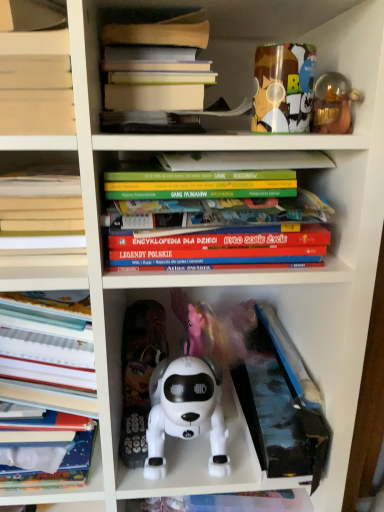
The width and height of the screenshot is (384, 512). Find the location of `blue matte book at lower right`. blue matte book at lower right is located at coordinates pyautogui.click(x=282, y=405).

Describe the element at coordinates (282, 405) in the screenshot. I see `blue matte book at lower right` at that location.

What do you see at coordinates (186, 412) in the screenshot?
I see `white plastic robot dog at center, which ranks as the second toy in left-to-right order` at bounding box center [186, 412].

What do you see at coordinates (48, 381) in the screenshot?
I see `white paper book at left, positioned as the fourth book in top-to-bottom order` at bounding box center [48, 381].

The image size is (384, 512). What do you see at coordinates (283, 88) in the screenshot? I see `matte plastic cup at upper right, the second toy from the right` at bounding box center [283, 88].

Measure the distance between matte plastic cup at upper right, placed as the first toy when sorted from top to bottom, and camera.

matte plastic cup at upper right, placed as the first toy when sorted from top to bottom, is 51.98 centimeters from camera.

Find the location of `hardcover books at upper center, the 4th book when ordered from bottom to top`. hardcover books at upper center, the 4th book when ordered from bottom to top is located at coordinates (156, 64).

What is the approximate width of translucent glass figurine at upper right, which is the fourth toy from left to right?

The width of translucent glass figurine at upper right, which is the fourth toy from left to right, is 2.68 inches.

Identify the location of blue matte book at lower right. This screenshot has width=384, height=512. (282, 405).

Is point (294, 418) positioned before point (299, 75)?

No, (294, 418) is further to viewer.

Are blue matte book at lower right and matte plastic cup at upper right, which appears as the 3th toy when viewed from the left, making contact?

No, blue matte book at lower right is not in contact with matte plastic cup at upper right, which appears as the 3th toy when viewed from the left.

Who is shorter, blue matte book at lower right or matte plastic cup at upper right, which appears as the 3th toy when viewed from the left?

matte plastic cup at upper right, which appears as the 3th toy when viewed from the left, is shorter.

From a real-world perspective, is blue matte book at lower right under matte plastic cup at upper right, which appears as the 3th toy when viewed from the left?

Yes, from a real-world perspective, blue matte book at lower right is under matte plastic cup at upper right, which appears as the 3th toy when viewed from the left.

Who is bigger, hardcover book at left, which is the second book in bottom-to-top order, or blue matte book at lower right?

Bigger between the two is blue matte book at lower right.

Is hardcover book at left, which is the second book in bottom-to-top order, not inside blue matte book at lower right?

Yes, hardcover book at left, which is the second book in bottom-to-top order, is outside of blue matte book at lower right.

Is hardcover book at left, which is the second book in bottom-to-top order, oriented away from blue matte book at lower right?

No, hardcover book at left, which is the second book in bottom-to-top order,'s orientation is not away from blue matte book at lower right.

From a real-world perspective, between hardcover book at left, which is the second book in bottom-to-top order, and blue matte book at lower right, who is vertically higher?

hardcover book at left, which is the second book in bottom-to-top order, is physically above.

Which is closer, (x=305, y=74) or (x=209, y=366)?

Point (x=305, y=74) is closer to the camera than point (x=209, y=366).

Is matte plastic cup at upper right, arranged as the 4th toy when ordered from the bottom, positioned far away from white plastic robot dog at center, placed as the 3th toy when sorted from right to left?

They are positioned close to each other.

From the image's perspective, which is below, matte plastic cup at upper right, placed as the first toy when sorted from top to bottom, or white plastic robot dog at center, which is the 1th toy in bottom-to-top order?

white plastic robot dog at center, which is the 1th toy in bottom-to-top order, appears lower in the image.

Which object is further away from the camera, matte plastic cup at upper right, placed as the first toy when sorted from top to bottom, or white plastic robot dog at center, placed as the 3th toy when sorted from right to left?

white plastic robot dog at center, placed as the 3th toy when sorted from right to left, is more distant.

In the scene shown: Between hardcover books at upper center, the 4th book when ordered from bottom to top, and hardcover books at center, the second book viewed from the top, which one appears on the left side from the viewer's perspective?

From the viewer's perspective, hardcover books at upper center, the 4th book when ordered from bottom to top, appears more on the left side.

Is hardcover books at upper center, which is the 1th book from top to bottom, situated inside hardcover books at center, positioned as the third book in bottom-to-top order, or outside?

hardcover books at upper center, which is the 1th book from top to bottom, lies outside hardcover books at center, positioned as the third book in bottom-to-top order.

How different are the orientations of hardcover books at upper center, which is the 1th book from top to bottom, and hardcover books at center, the second book viewed from the top, in degrees?

1.43 degrees.

Is hardcover books at upper center, which is the 1th book from top to bottom, shorter than hardcover books at center, positioned as the third book in bottom-to-top order?

Yes.

Who is smaller, white paper book at left, acting as the 1th book starting from the bottom, or blue matte book at lower right?

With smaller size is blue matte book at lower right.

From the picture: Does white paper book at left, acting as the 1th book starting from the bottom, have a greater width compared to blue matte book at lower right?

No.

What are the coordinates of `paperback book located underneath the white paper book at left, positioned as the fourth book in top-to-bottom order (from a real-world perspective)` in the screenshot? It's located at (x=282, y=405).

Could you tell me if white paper book at left, acting as the 1th book starting from the bottom, is facing blue matte book at lower right?

No, white paper book at left, acting as the 1th book starting from the bottom, is not facing towards blue matte book at lower right.

Considering the points (146, 42) and (123, 457), which point is in front, point (146, 42) or point (123, 457)?

The point (146, 42) is more forward.

From their relative heights in the image, would you say hardcover books at upper center, the 4th book when ordered from bottom to top, is taller or shorter than white plastic toy dog at center, placed as the 4th toy when sorted from right to left?

Considering their sizes, hardcover books at upper center, the 4th book when ordered from bottom to top, has less height than white plastic toy dog at center, placed as the 4th toy when sorted from right to left.

Considering the sizes of objects hardcover books at upper center, which is the 1th book from top to bottom, and white plastic toy dog at center, placed as the 4th toy when sorted from right to left, in the image provided, who is thinner, hardcover books at upper center, which is the 1th book from top to bottom, or white plastic toy dog at center, placed as the 4th toy when sorted from right to left,?

white plastic toy dog at center, placed as the 4th toy when sorted from right to left, is thinner.

Would you say hardcover books at upper center, the 4th book when ordered from bottom to top, is inside or outside white plastic toy dog at center, acting as the second toy starting from the bottom?

hardcover books at upper center, the 4th book when ordered from bottom to top, is not inside white plastic toy dog at center, acting as the second toy starting from the bottom, it's outside.

Does hardcover books at center, positioned as the third book in bottom-to-top order, turn towards hardcover books at upper center, the 4th book when ordered from bottom to top?

No, hardcover books at center, positioned as the third book in bottom-to-top order, does not turn towards hardcover books at upper center, the 4th book when ordered from bottom to top.

Who is smaller, hardcover books at center, positioned as the third book in bottom-to-top order, or hardcover books at upper center, the 4th book when ordered from bottom to top?

hardcover books at upper center, the 4th book when ordered from bottom to top.

Locate an element on the screen. This screenshot has width=384, height=512. the 1st book to the left of the hardcover books at center, positioned as the third book in bottom-to-top order, counting from the anchor's position is located at coordinates (156, 64).

Who is more distant, hardcover books at center, the second book viewed from the top, or hardcover books at upper center, the 4th book when ordered from bottom to top?

hardcover books at upper center, the 4th book when ordered from bottom to top, is further from the camera.

In order to click on the 1st toy counting from the left of the blue matte book at lower right in this screenshot , I will do `click(283, 88)`.

You are a GUI agent. You are given a task and a screenshot of the screen. Output one action in this format:
    pyautogui.click(x=<x>, y=<y>)
    Task: Click on the paperback book below the hardcover book at left, which is the second book in bottom-to-top order (from a real-world perspective)
    This screenshot has height=512, width=384.
    Given the screenshot: What is the action you would take?
    pyautogui.click(x=282, y=405)

From the image, which object appears to be farther from white paper book at left, acting as the 1th book starting from the bottom, hardcover book at left, acting as the third book starting from the top, or hardcover books at upper center, which is the 1th book from top to bottom?

hardcover books at upper center, which is the 1th book from top to bottom.

Estimate the real-world distances between objects in this image. Which object is closer to translucent glass figurine at upper right, which is the fourth toy from left to right, matte plastic cup at upper right, arranged as the 4th toy when ordered from the bottom, or hardcover books at upper center, which is the 1th book from top to bottom?

matte plastic cup at upper right, arranged as the 4th toy when ordered from the bottom, is closer to translucent glass figurine at upper right, which is the fourth toy from left to right.

Looking at the image, which one is located further to hardcover books at center, positioned as the third book in bottom-to-top order, white plastic robot dog at center, placed as the 3th toy when sorted from right to left, or hardcover books at upper center, the 4th book when ordered from bottom to top?

The object further to hardcover books at center, positioned as the third book in bottom-to-top order, is white plastic robot dog at center, placed as the 3th toy when sorted from right to left.

Based on their spatial positions, is translucent glass figurine at upper right, which is the second toy from top to bottom, or white plastic robot dog at center, which is the 1th toy in bottom-to-top order, closer to blue matte book at lower right?

Based on the image, white plastic robot dog at center, which is the 1th toy in bottom-to-top order, appears to be nearer to blue matte book at lower right.

When comparing their distances from hardcover books at center, positioned as the third book in bottom-to-top order, does white paper book at left, acting as the 1th book starting from the bottom, or translucent glass figurine at upper right, placed as the 1th toy when sorted from right to left, seem closer?

translucent glass figurine at upper right, placed as the 1th toy when sorted from right to left, is closer to hardcover books at center, positioned as the third book in bottom-to-top order.

When comparing their distances from blue matte book at lower right, does white paper book at left, acting as the 1th book starting from the bottom, or hardcover books at upper center, the 4th book when ordered from bottom to top, seem further?

hardcover books at upper center, the 4th book when ordered from bottom to top.

Which object lies nearer to the anchor point blue matte book at lower right, white plastic toy dog at center, placed as the 4th toy when sorted from right to left, or hardcover book at left, acting as the third book starting from the top?

white plastic toy dog at center, placed as the 4th toy when sorted from right to left, is positioned closer to the anchor blue matte book at lower right.

Looking at the image, which one is located closer to white paper book at left, acting as the 1th book starting from the bottom, white plastic robot dog at center, which ranks as the second toy in left-to-right order, or matte plastic cup at upper right, placed as the first toy when sorted from top to bottom?

white plastic robot dog at center, which ranks as the second toy in left-to-right order.

At what (x,y) coordinates should I click in order to perform the action: click on toy between matte plastic cup at upper right, which appears as the 3th toy when viewed from the left, and white plastic toy dog at center, which ranks as the first toy in left-to-right order, in the up-down direction. Please return your answer as a coordinate pair (x, y). Image resolution: width=384 pixels, height=512 pixels. Looking at the image, I should click on (x=333, y=104).

Identify the location of toy between matte plastic cup at upper right, the second toy from the right, and hardcover books at center, the second book viewed from the top, vertically. The image size is (384, 512). (333, 104).

Where is `paperback book between hardcover book at left, which is the second book in bottom-to-top order, and translucent glass figurine at upper right, which is the fourth toy from left to right`? The height and width of the screenshot is (512, 384). paperback book between hardcover book at left, which is the second book in bottom-to-top order, and translucent glass figurine at upper right, which is the fourth toy from left to right is located at coordinates (282, 405).

You are a GUI agent. You are given a task and a screenshot of the screen. Output one action in this format:
    pyautogui.click(x=<x>, y=<y>)
    Task: Click on the toy between translucent glass figurine at upper right, which is the second toy from top to bottom, and white plastic robot dog at center, placed as the 3th toy when sorted from right to left, in the up-down direction
    
    Given the screenshot: What is the action you would take?
    pyautogui.click(x=139, y=374)